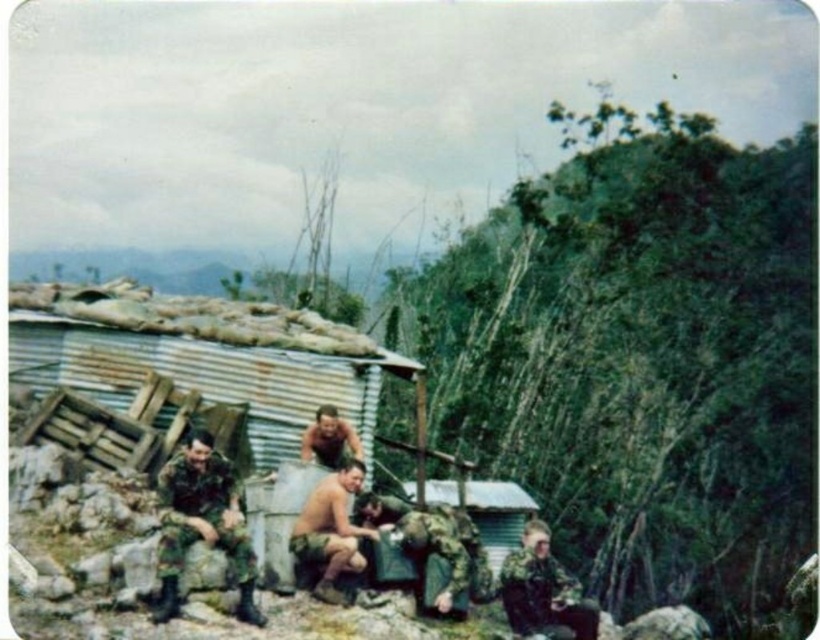
Is camouflage fabric uniform at lower left positioned in front of camouflage fabric uniform at lower right?

Yes.

What do you see at coordinates (201, 522) in the screenshot? I see `camouflage fabric uniform at lower left` at bounding box center [201, 522].

What do you see at coordinates (201, 522) in the screenshot?
I see `camouflage fabric uniform at lower left` at bounding box center [201, 522].

You are a GUI agent. You are given a task and a screenshot of the screen. Output one action in this format:
    pyautogui.click(x=<x>, y=<y>)
    Task: Click on the camouflage fabric uniform at lower left
    This screenshot has height=640, width=820.
    Given the screenshot: What is the action you would take?
    pyautogui.click(x=201, y=522)

At what (x,y) coordinates should I click in order to perform the action: click on camouflage fabric shirt at center. Please return your answer as a coordinate pair (x, y). This screenshot has width=820, height=640. Looking at the image, I should click on (422, 545).

Is camouflage fabric shirt at center to the left of brown camouflage uniform at center from the viewer's perspective?

In fact, camouflage fabric shirt at center is to the right of brown camouflage uniform at center.

Where is `camouflage fabric shirt at center`? This screenshot has height=640, width=820. camouflage fabric shirt at center is located at coordinates (422, 545).

Is point (527, 525) behind point (330, 422)?

That is False.

Which is above, camouflage fabric uniform at lower right or brown camouflage uniform at center?

brown camouflage uniform at center is higher up.

Is point (515, 609) positioned after point (344, 419)?

No.

What are the coordinates of `camouflage fabric uniform at lower right` in the screenshot? It's located at (543, 589).